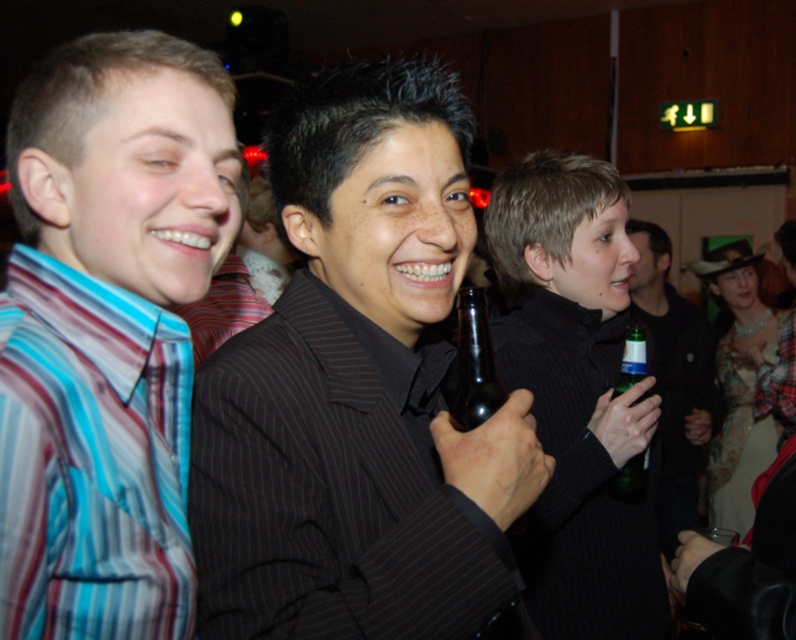
In the scene shown: You are at a party and want to take a photo of the point at coordinates (59, 595). The camera you have can only focus on objects within 20 inches. Will the point be in focus?

The point at coordinates (59, 595) is 21.58 inches from the camera, which is beyond the 20 inches focus range. Therefore, the point will not be in focus.

You are at a party and want to take a photo of both the person on the left and the person on the right. You notice two points in the image labeled as point (190, 323) and point (465, 333). Which point is closer to you, the photographer?

Point (190, 323) is closer to you than point (465, 333).

Based on the photo, you are a photographer trying to capture a closeup shot of the brown glass bottle at center. The matte black suit at center is blocking your view. Can you estimate if moving the bottle to the right side of the suit would allow you to see the entire bottle?

The matte black suit at center might be wider than brown glass bottle at center, so moving the bottle to the right side of the suit may not fully reveal it if the suit is wider. You might need to adjust the angle or position further.